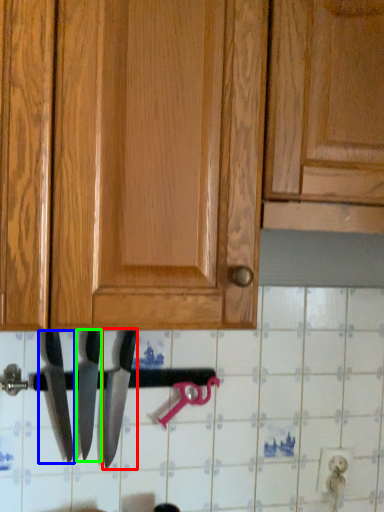
Question: Which object is positioned farthest from knife (highlighted by a red box)? Select from knife (highlighted by a blue box) and knife (highlighted by a green box).

Choices:
 (A) knife
 (B) knife

Answer: (A)